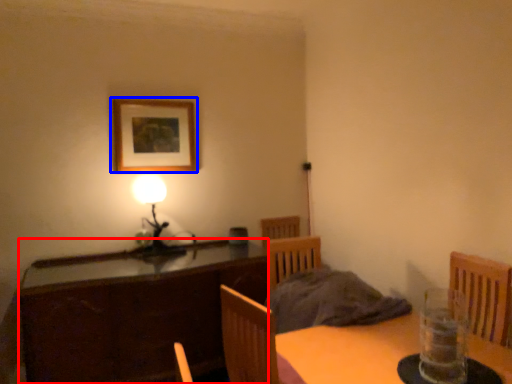
Question: Among these objects, which one is farthest to the camera, cabinetry (highlighted by a red box) or picture frame (highlighted by a blue box)?

Choices:
 (A) cabinetry
 (B) picture frame

Answer: (B)